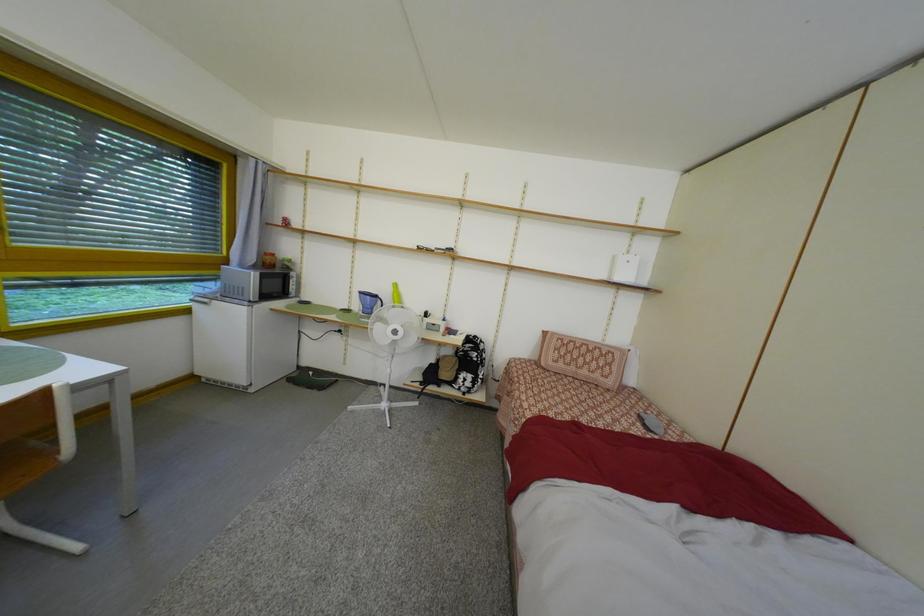
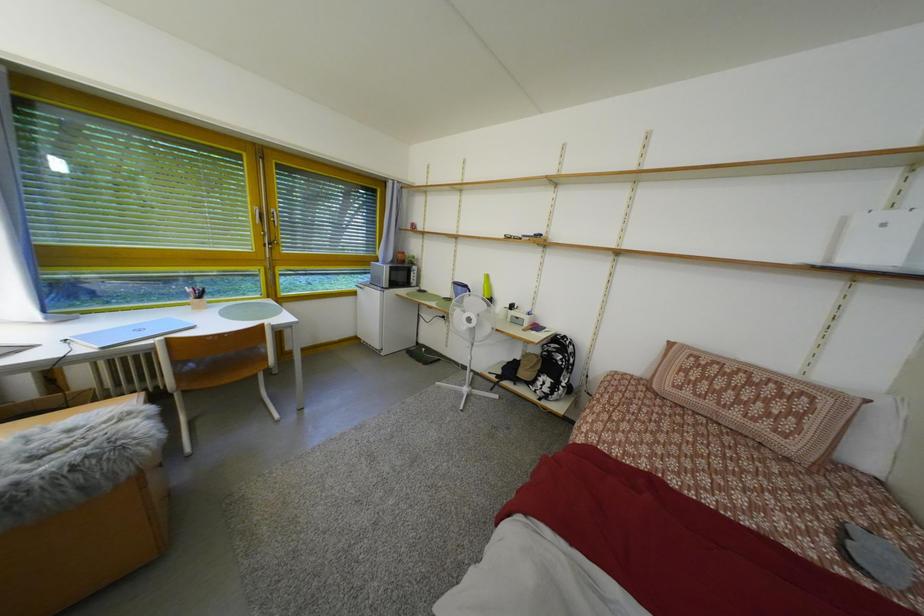
Question: The images are taken continuously from a first-person perspective. In which direction is your viewpoint rotating?

Choices:
 (A) Left
 (B) Right
 (C) Up
 (D) Down

Answer: (A)